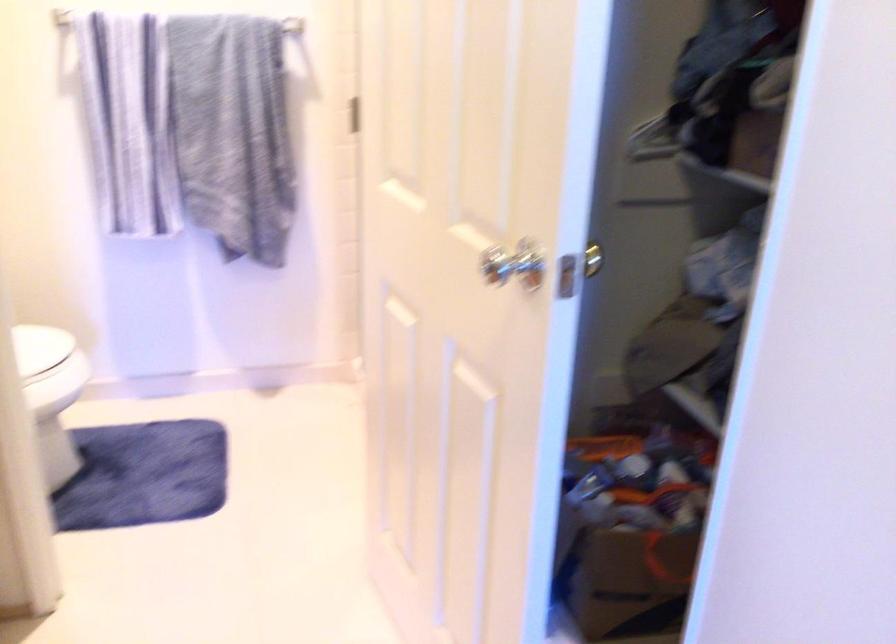
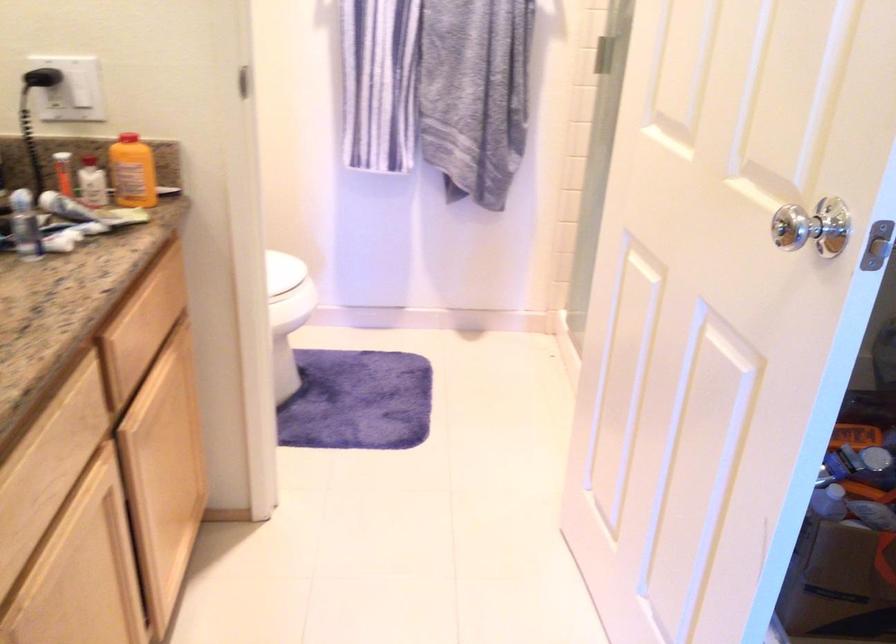
Question: The camera is either moving clockwise (left) or counter-clockwise (right) around the object. The first image is from the beginning of the video and the second image is from the end. Is the camera moving left or right when shooting the video?

Choices:
 (A) Left
 (B) Right

Answer: (B)